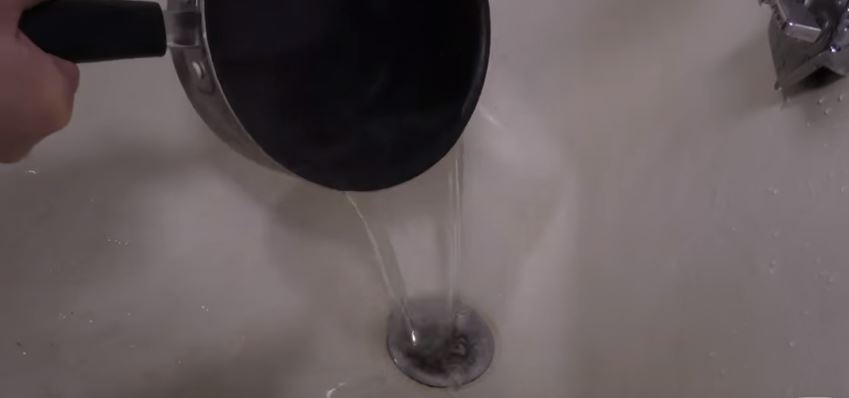
Locate an element on the screen. The width and height of the screenshot is (849, 398). sink is located at coordinates (639, 200).